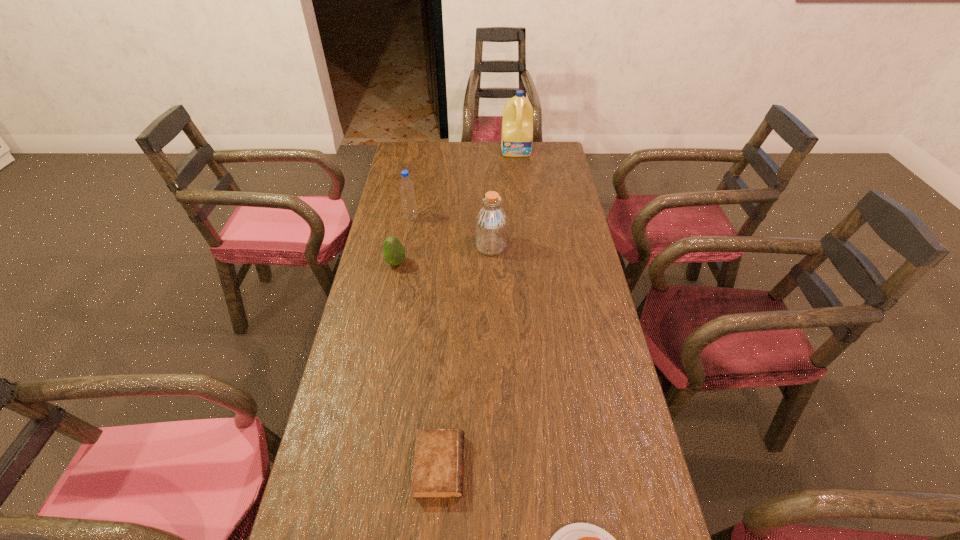
The height and width of the screenshot is (540, 960). What are the coordinates of `the tallest object` in the screenshot? It's located at (517, 124).

Image resolution: width=960 pixels, height=540 pixels. I want to click on the farthest object, so click(x=517, y=124).

The width and height of the screenshot is (960, 540). Find the location of `the fourth object from left to right`. the fourth object from left to right is located at coordinates [491, 222].

The image size is (960, 540). In order to click on the second farthest object in this screenshot , I will do `click(406, 186)`.

The width and height of the screenshot is (960, 540). What are the coordinates of `the third shortest object` in the screenshot? It's located at (394, 253).

I want to click on the second nearest object, so click(438, 467).

Find the location of a particular element. the third object from left to right is located at coordinates (438, 467).

This screenshot has width=960, height=540. Find the location of `vacant space located 0.050m on the label of the detergent`. vacant space located 0.050m on the label of the detergent is located at coordinates (518, 164).

At what (x,y) coordinates should I click in order to perform the action: click on free space located on the left of the fourth object from left to right. Please return your answer as a coordinate pair (x, y). Looking at the image, I should click on (434, 246).

You are a GUI agent. You are given a task and a screenshot of the screen. Output one action in this format:
    pyautogui.click(x=<x>, y=<y>)
    Task: Click on the vacant point located on the right of the fifth nearest object
    The image size is (960, 540).
    Given the screenshot: What is the action you would take?
    pyautogui.click(x=483, y=218)